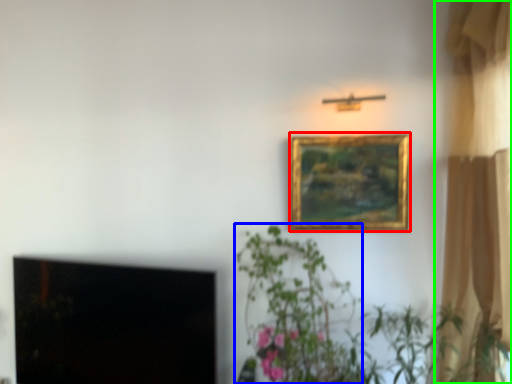
Question: Which object is positioned closest to picture frame (highlighted by a red box)? Select from plant (highlighted by a blue box) and curtain (highlighted by a green box).

Choices:
 (A) plant
 (B) curtain

Answer: (A)